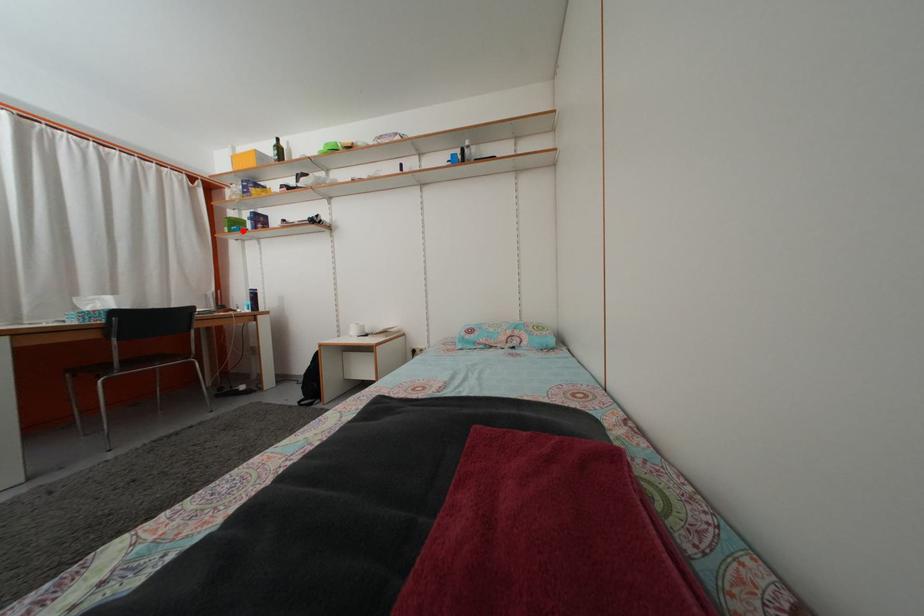
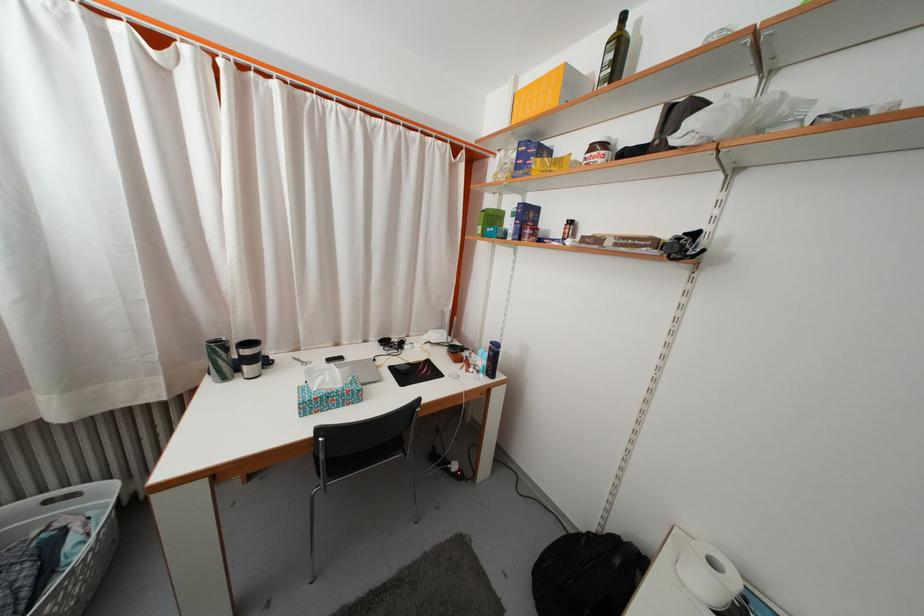
Where in the second image is the point corresponding to the highlighted location from the first image?

(500, 225)